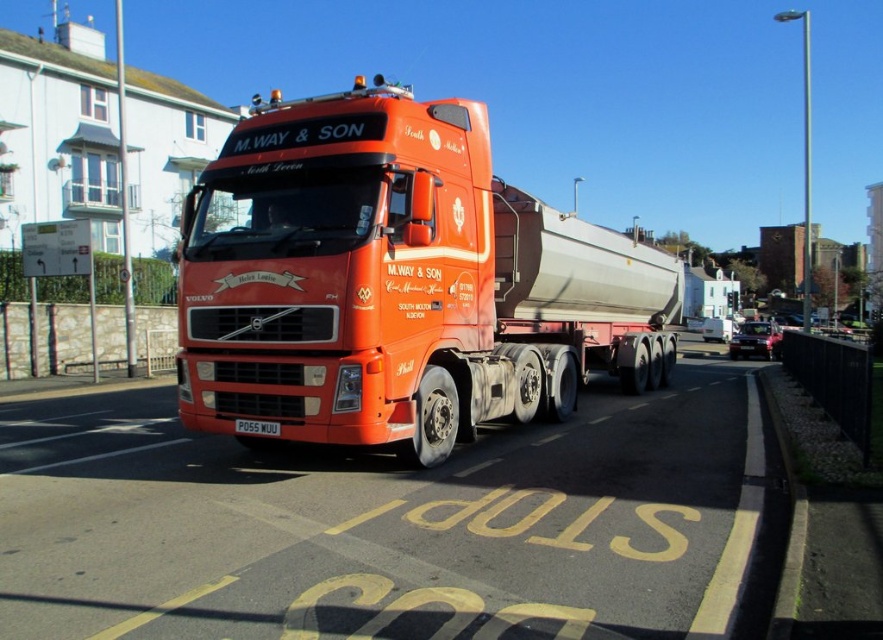
Question: Is matte orange truck at center smaller than white plastic license plate at center?

Choices:
 (A) no
 (B) yes

Answer: (A)

Question: Does matte orange truck at center have a smaller size compared to white plastic license plate at center?

Choices:
 (A) yes
 (B) no

Answer: (B)

Question: Which of the following is the farthest from the observer?

Choices:
 (A) (472, 380)
 (B) (259, 428)

Answer: (A)

Question: Does matte orange truck at center have a lesser width compared to white plastic license plate at center?

Choices:
 (A) no
 (B) yes

Answer: (A)

Question: Which point appears farthest from the camera in this image?

Choices:
 (A) (314, 346)
 (B) (277, 426)

Answer: (B)